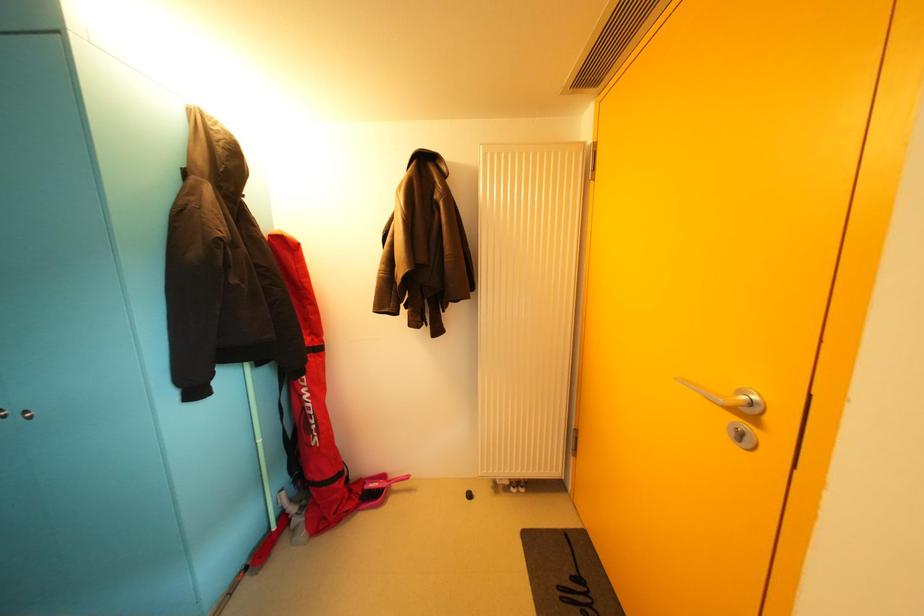
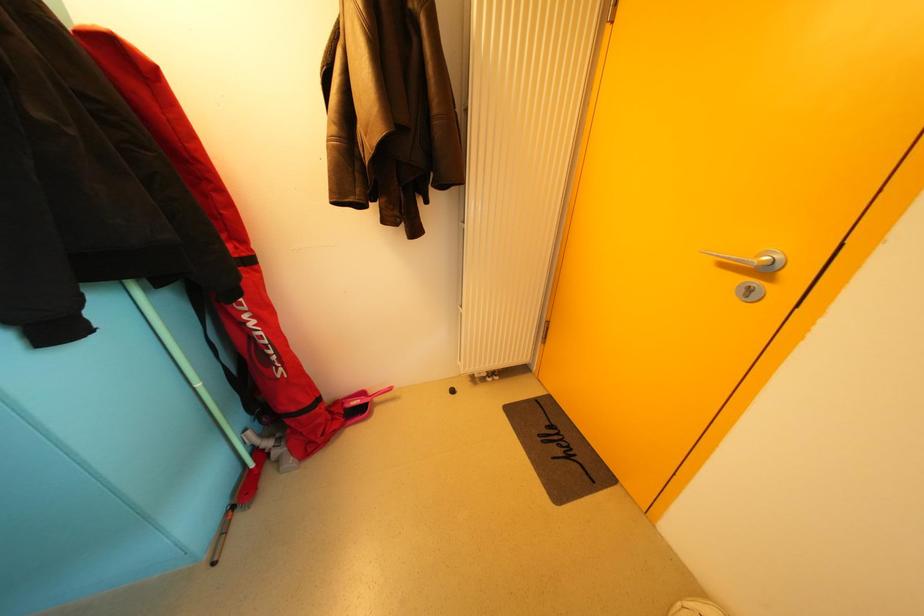
In a continuous first-person perspective shot, in which direction is the camera moving?

The cameraman walked toward left, forward.